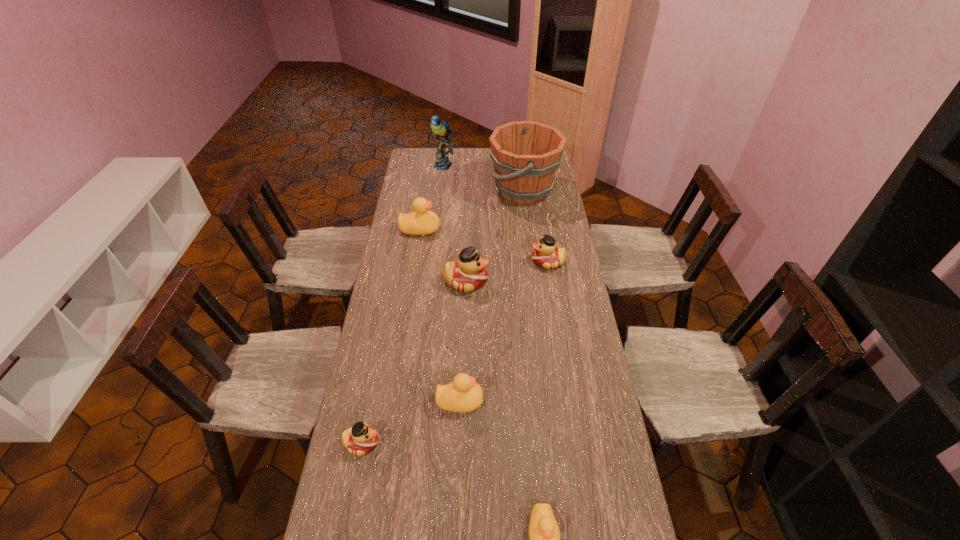
Identify the location of parrot. (441, 130).

You are a GUI agent. You are given a task and a screenshot of the screen. Output one action in this format:
    pyautogui.click(x=<x>, y=<y>)
    Task: Click on the bucket
    This screenshot has height=540, width=960.
    Given the screenshot: What is the action you would take?
    pyautogui.click(x=525, y=154)

Image resolution: width=960 pixels, height=540 pixels. In order to click on the second red duck from right to left in this screenshot , I will do `click(469, 273)`.

The image size is (960, 540). What are the coordinates of `the farthest yellow duck` in the screenshot? It's located at (420, 222).

This screenshot has height=540, width=960. I want to click on the biggest yellow duck, so click(x=420, y=222).

You are a GUI agent. You are given a task and a screenshot of the screen. Output one action in this format:
    pyautogui.click(x=<x>, y=<y>)
    Task: Click on the rightmost duck
    
    Given the screenshot: What is the action you would take?
    pyautogui.click(x=546, y=255)

The image size is (960, 540). In order to click on the second biggest red duck in this screenshot , I will do `click(546, 255)`.

Where is `the second yellow duck from right to left`? the second yellow duck from right to left is located at coordinates (462, 395).

You are a GUI agent. You are given a task and a screenshot of the screen. Output one action in this format:
    pyautogui.click(x=<x>, y=<y>)
    Task: Click on the second smallest yellow duck
    
    Given the screenshot: What is the action you would take?
    pyautogui.click(x=462, y=395)

This screenshot has height=540, width=960. I want to click on the fifth farthest duck, so click(x=360, y=439).